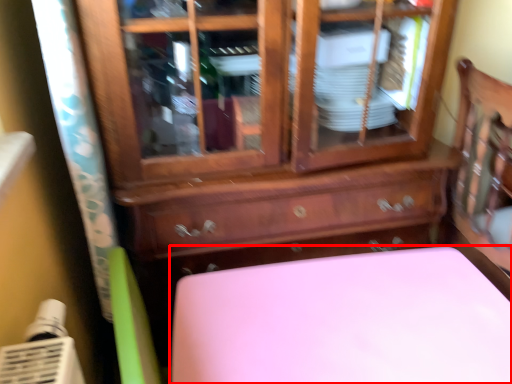
Question: Considering the relative positions of furniture (annotated by the red box) and chest of drawers in the image provided, where is furniture (annotated by the red box) located with respect to the staircase?

Choices:
 (A) right
 (B) left

Answer: (A)